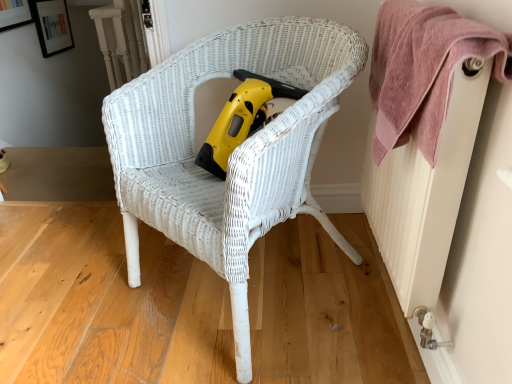
At what (x,y) coordinates should I click in order to perform the action: click on vacant space underneath white wicker chair at center (from a real-world perspective). Please return your answer as a coordinate pair (x, y). The image size is (512, 384). Looking at the image, I should click on (253, 288).